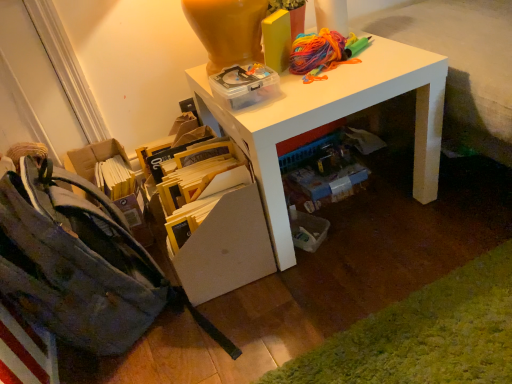
Question: Should I look upward or downward to see floral canvas shoulder bag at lower left?

Choices:
 (A) down
 (B) up

Answer: (A)

Question: Does yellow cardboard at lower left appear on the right side of white glossy desk at upper center?

Choices:
 (A) no
 (B) yes

Answer: (A)

Question: Does yellow cardboard at lower left have a greater height compared to white glossy desk at upper center?

Choices:
 (A) no
 (B) yes

Answer: (A)

Question: Is yellow cardboard at lower left further to the viewer compared to white glossy desk at upper center?

Choices:
 (A) yes
 (B) no

Answer: (B)

Question: Is yellow cardboard at lower left wider than white glossy desk at upper center?

Choices:
 (A) no
 (B) yes

Answer: (B)

Question: From a real-world perspective, is yellow cardboard at lower left on top of white glossy desk at upper center?

Choices:
 (A) yes
 (B) no

Answer: (B)

Question: From the image's perspective, would you say yellow cardboard at lower left is shown under white glossy desk at upper center?

Choices:
 (A) yes
 (B) no

Answer: (A)

Question: From a real-world perspective, is yellow cardboard book at lower center positioned under yellow cardboard at lower left based on gravity?

Choices:
 (A) yes
 (B) no

Answer: (B)

Question: Is yellow cardboard book at lower center far away from yellow cardboard at lower left?

Choices:
 (A) yes
 (B) no

Answer: (B)

Question: From the image's perspective, would you say yellow cardboard book at lower center is shown under yellow cardboard at lower left?

Choices:
 (A) no
 (B) yes

Answer: (A)

Question: Is yellow cardboard book at lower center positioned with its back to yellow cardboard at lower left?

Choices:
 (A) yes
 (B) no

Answer: (A)

Question: Considering the relative sizes of yellow cardboard book at lower center and yellow cardboard at lower left in the image provided, is yellow cardboard book at lower center bigger than yellow cardboard at lower left?

Choices:
 (A) no
 (B) yes

Answer: (A)

Question: From a real-world perspective, is yellow cardboard book at lower center over yellow cardboard at lower left?

Choices:
 (A) yes
 (B) no

Answer: (A)

Question: Is yellow cardboard book at lower center wider than floral canvas shoulder bag at lower left?

Choices:
 (A) yes
 (B) no

Answer: (B)